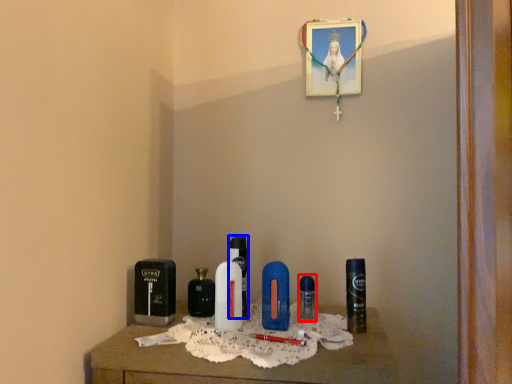
Question: Which object is further to the camera taking this photo, perfume (highlighted by a red box) or perfume (highlighted by a blue box)?

Choices:
 (A) perfume
 (B) perfume

Answer: (A)